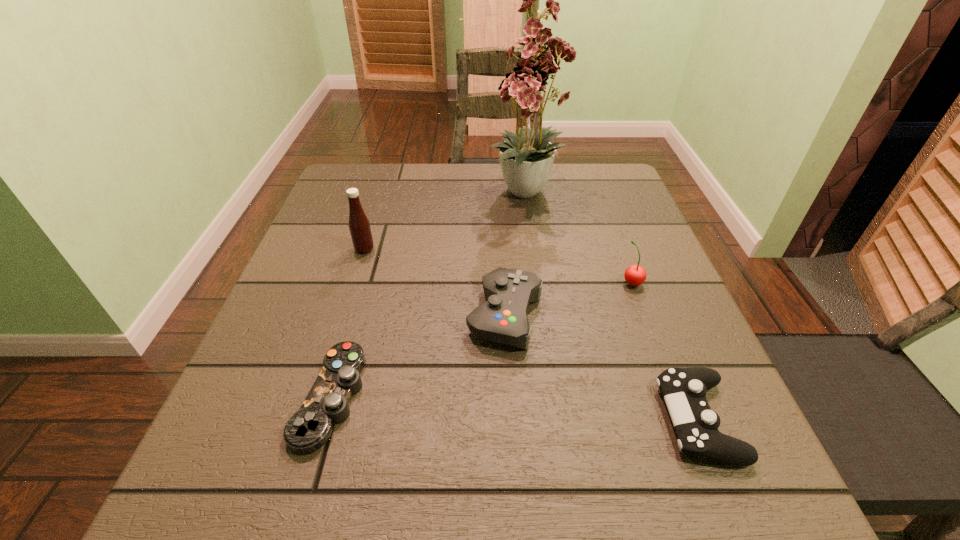
Identify the location of free space at the far left corner of the desktop. The height and width of the screenshot is (540, 960). (341, 174).

You are a GUI agent. You are given a task and a screenshot of the screen. Output one action in this format:
    pyautogui.click(x=<x>, y=<y>)
    Task: Click on the vacant space at the near right corner of the desktop
    This screenshot has height=540, width=960.
    Given the screenshot: What is the action you would take?
    pyautogui.click(x=732, y=470)

You are a GUI agent. You are given a task and a screenshot of the screen. Output one action in this format:
    pyautogui.click(x=<x>, y=<y>)
    Task: Click on the blank region between the shortest control and the fifth tallest object
    This screenshot has width=960, height=540.
    Given the screenshot: What is the action you would take?
    pyautogui.click(x=515, y=408)

At what (x,y) coordinates should I click in order to perform the action: click on free space that is in between the cherry and the shortest control. Please return your answer as a coordinate pair (x, y). Looking at the image, I should click on (481, 340).

Identify the location of vacant region between the tallest object and the fourth shortest object. (580, 238).

Locate an element on the screen. Image resolution: width=960 pixels, height=540 pixels. vacant point located between the fifth tallest object and the third tallest object is located at coordinates (665, 351).

Identify the location of unoccupied position between the flower arrangement and the rightmost control. (613, 307).

Locate an element on the screen. The image size is (960, 540). unoccupied position between the shortest control and the Tabasco sauce is located at coordinates (348, 323).

Where is `free space between the cherry and the Tabasco sauce`? free space between the cherry and the Tabasco sauce is located at coordinates (498, 266).

Image resolution: width=960 pixels, height=540 pixels. In order to click on free space between the second control from right to left and the fourth shortest object in this screenshot , I will do `click(568, 299)`.